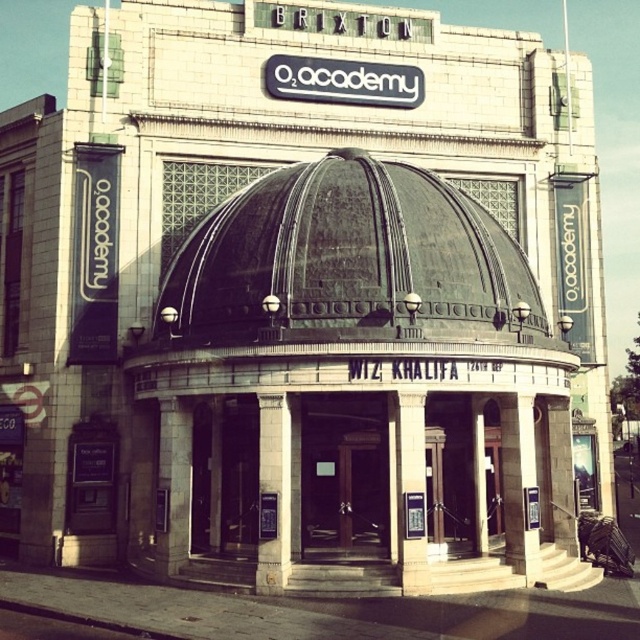
You are standing in front of the Brixton O2 Academy and want to take a photo of both the bronze textured dome at center and the white stone pillar at center. If your camera can focus on objects up to 15 meters away, will you be able to capture both in a single shot without moving?

The bronze textured dome at center is 15.62 meters away from the white stone pillar at center. Since the camera can focus up to 15 meters, the distance between them exceeds the camera range, so you cannot capture both in a single shot without moving.

You are a delivery person with a large package that requires a 10 feet wide path to maneuver. You are standing in front of the Brixton O2 Academy and need to move the package between the wooden door at center and the white stone pillar at center. Is there enough space for you to move the package through this path?

The wooden door at center and white stone pillar at center are 21.79 feet apart from each other. Since the required space is 10 feet, the distance between them is sufficient for maneuvering the package.

You are standing in front of the Brixton O2 Academy and want to take a photo of the dome and the signage. You notice two points marked on your camera screen at coordinates point (x=358, y=237) and point (x=328, y=424). Which point is closer to your camera lens?

Point (x=358, y=237) is closer to the camera lens than point (x=328, y=424).